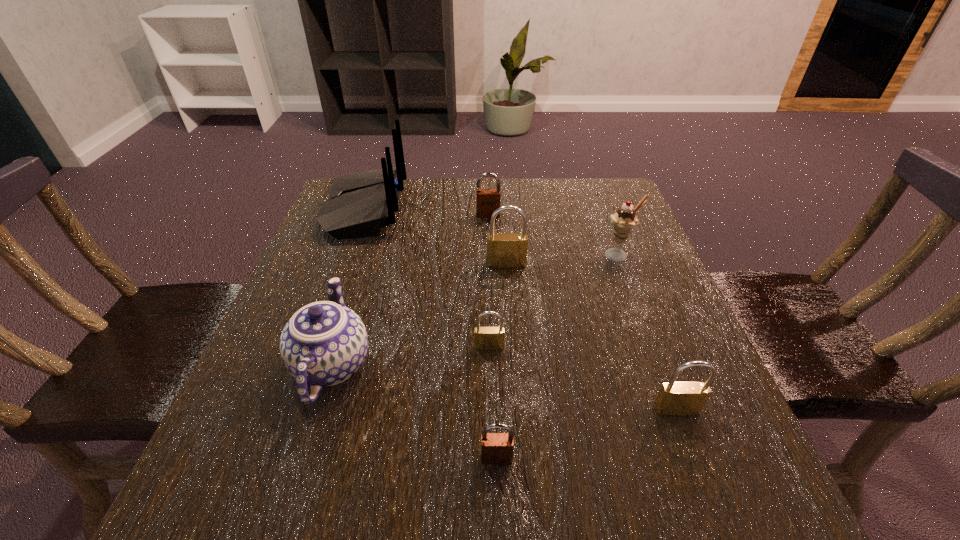
In order to click on the third farthest padlock in this screenshot , I will do `click(486, 338)`.

What are the coordinates of `the second nearest brass padlock` in the screenshot? It's located at (486, 338).

Where is `the nearest padlock`? the nearest padlock is located at coordinates (496, 448).

The image size is (960, 540). Identify the location of the smaller brown padlock. (496, 448).

You are a GUI agent. You are given a task and a screenshot of the screen. Output one action in this format:
    pyautogui.click(x=<x>, y=<y>)
    Task: Click on the vacant region located 0.240m on the back of the router
    The image size is (960, 540).
    Given the screenshot: What is the action you would take?
    pyautogui.click(x=495, y=210)

Identify the location of vacant space located 0.310m on the left of the icecream. This screenshot has width=960, height=540. (465, 255).

Locate an element on the screen. vacant area located 0.380m on the front-facing side of the biggest brass padlock is located at coordinates (517, 424).

Image resolution: width=960 pixels, height=540 pixels. What are the coordinates of `vacant space located 0.320m at the spout of the chinaware` in the screenshot? It's located at [376, 224].

Where is `vacant region located 0.390m at the spout of the chinaware`? vacant region located 0.390m at the spout of the chinaware is located at coordinates (381, 208).

Identify the location of free point located 0.050m at the spout of the chinaware. This screenshot has height=540, width=960. (352, 299).